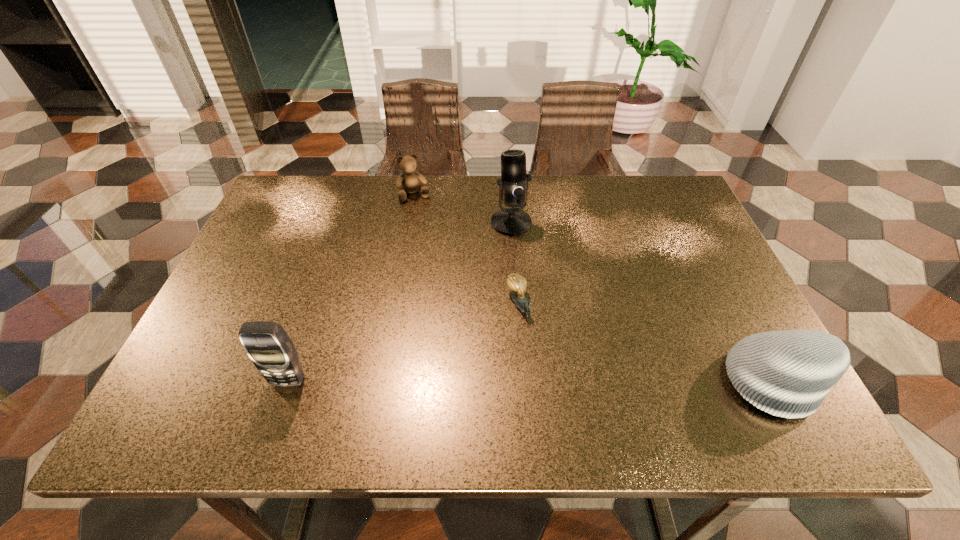
Identify the location of free space at the far right corner of the desktop. This screenshot has height=540, width=960. (656, 211).

Locate an element on the screen. unoccupied position between the microphone and the rightmost object is located at coordinates (645, 302).

Locate an element on the screen. vacant area that lies between the third nearest object and the leftmost object is located at coordinates (404, 342).

Locate an element on the screen. The width and height of the screenshot is (960, 540). vacant region between the rightmost object and the escargot is located at coordinates (649, 343).

The image size is (960, 540). I want to click on vacant area that lies between the third farthest object and the farthest object, so click(467, 249).

The width and height of the screenshot is (960, 540). Find the location of `vacant space in between the third nearest object and the fourth nearest object`. vacant space in between the third nearest object and the fourth nearest object is located at coordinates (516, 263).

Locate an element on the screen. This screenshot has height=540, width=960. unoccupied position between the microphone and the rightmost object is located at coordinates (645, 302).

This screenshot has width=960, height=540. I want to click on free space between the farthest object and the rightmost object, so click(596, 288).

The image size is (960, 540). Identify the location of blank region between the escargot and the farthest object. (467, 249).

Locate an element on the screen. This screenshot has width=960, height=540. free space between the farthest object and the second farthest object is located at coordinates (463, 208).